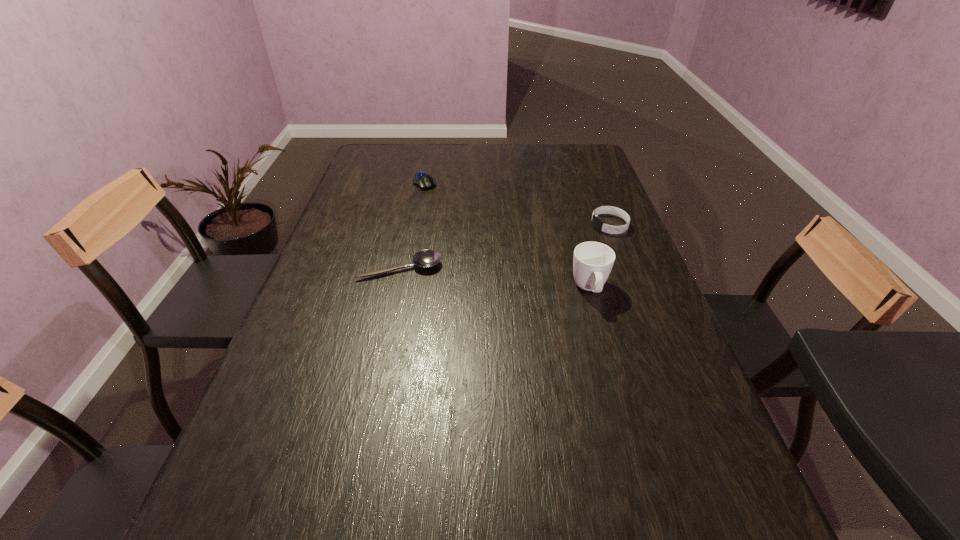
Identify which object is the second closest to the third object from left to right. Please provide its 2D coordinates. Your answer should be formatted as a tuple, i.e. [(x, y)], where the tuple contains the x and y coordinates of a point satisfying the conditions above.

[(425, 258)]

You are a GUI agent. You are given a task and a screenshot of the screen. Output one action in this format:
    pyautogui.click(x=<x>, y=<y>)
    Task: Click on the object that is the closest to the second shortest object
    Image resolution: width=960 pixels, height=540 pixels.
    Given the screenshot: What is the action you would take?
    pyautogui.click(x=425, y=258)